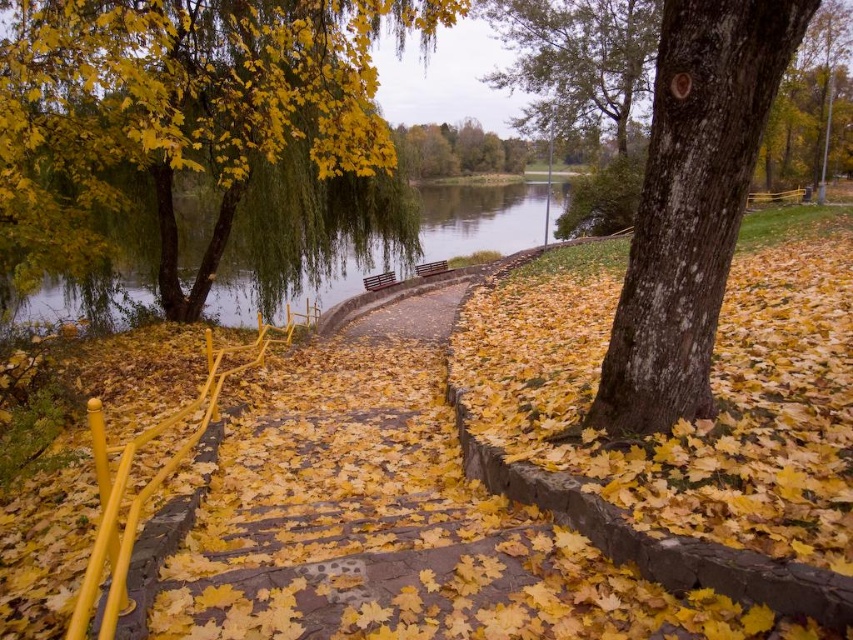
Question: Is yellow/glossy tree at upper left to the right of green rough bark tree at upper center from the viewer's perspective?

Choices:
 (A) no
 (B) yes

Answer: (A)

Question: Which point appears farthest from the camera in this image?

Choices:
 (A) (421, 273)
 (B) (67, 170)
 (C) (370, 285)

Answer: (A)

Question: Does green rough bark tree at upper center lie in front of wooden bench at center?

Choices:
 (A) no
 (B) yes

Answer: (A)

Question: Which point is farther to the camera?

Choices:
 (A) (579, 108)
 (B) (167, 240)
 (C) (386, 282)

Answer: (A)

Question: Which is nearer to the brown wooden bench at center?

Choices:
 (A) green rough bark tree at upper center
 (B) yellow/glossy tree at upper left
 (C) greenish water at center
 (D) wooden bench at center

Answer: (D)

Question: Does yellow/glossy tree at upper left come behind smooth brown bark at center?

Choices:
 (A) yes
 (B) no

Answer: (A)